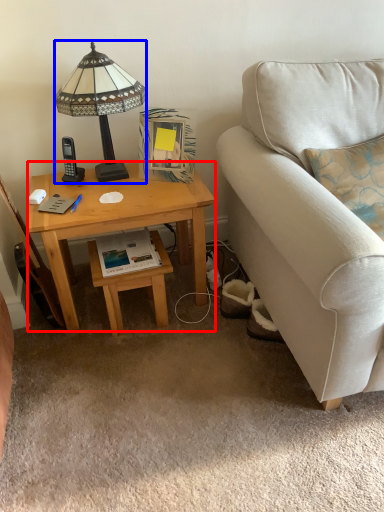
Question: Which object is closer to the camera taking this photo, desk (highlighted by a red box) or lamp (highlighted by a blue box)?

Choices:
 (A) desk
 (B) lamp

Answer: (B)